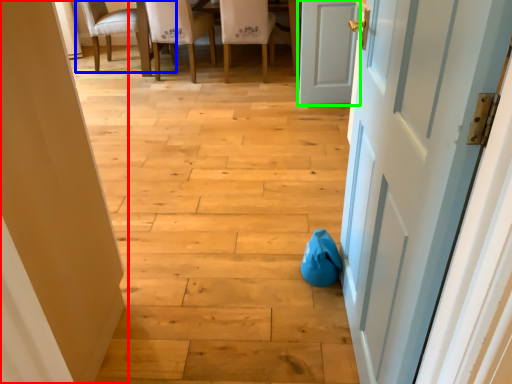
Question: Estimate the real-world distances between objects in this image. Which object is farther from door (highlighted by a red box), chair (highlighted by a blue box) or door (highlighted by a green box)?

Choices:
 (A) chair
 (B) door

Answer: (A)